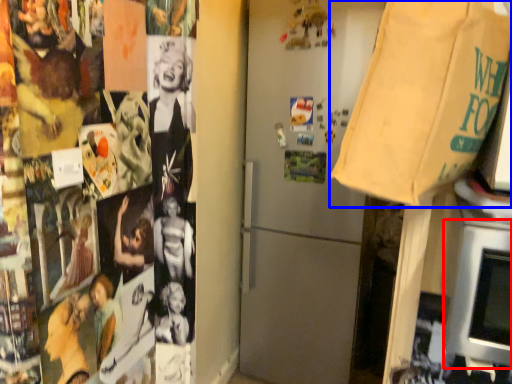
Question: Which object is further to the camera taking this photo, oven (highlighted by a red box) or grocery bag (highlighted by a blue box)?

Choices:
 (A) oven
 (B) grocery bag

Answer: (A)